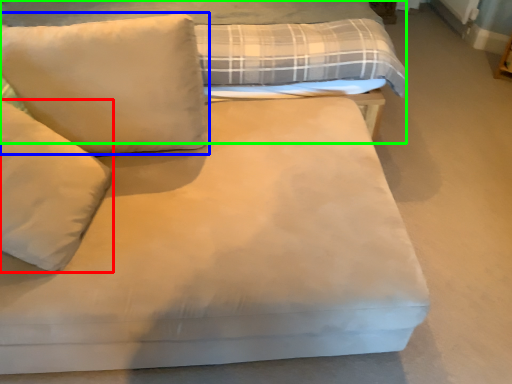
Question: Estimate the real-world distances between objects in this image. Which object is farther from pillow (highlighted by a red box), pillow (highlighted by a blue box) or bed (highlighted by a green box)?

Choices:
 (A) pillow
 (B) bed

Answer: (B)